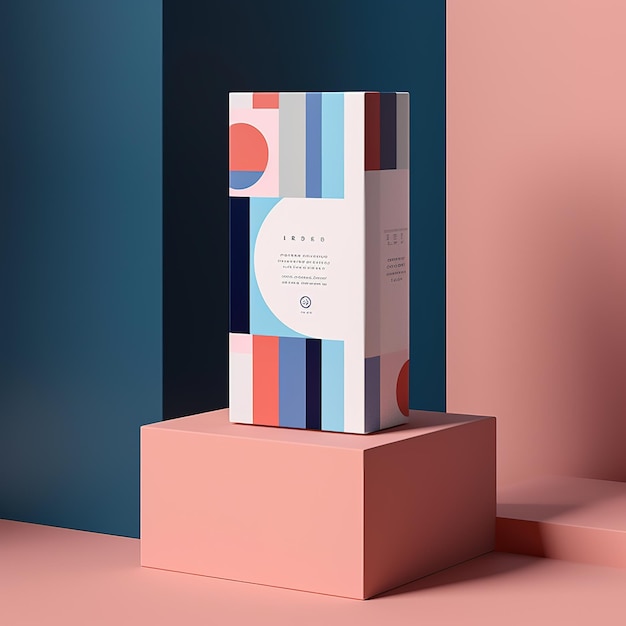
This screenshot has width=626, height=626. I want to click on wall, so click(473, 347).